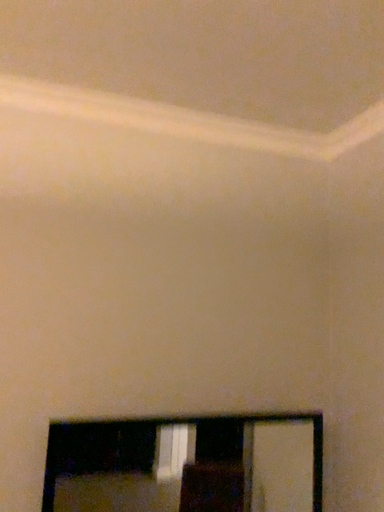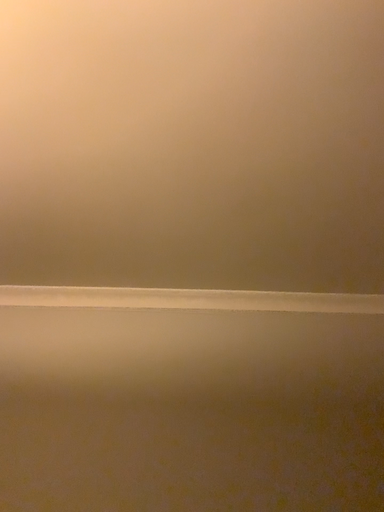
Question: Which way did the camera rotate in the video?

Choices:
 (A) rotated downward
 (B) rotated upward

Answer: (B)